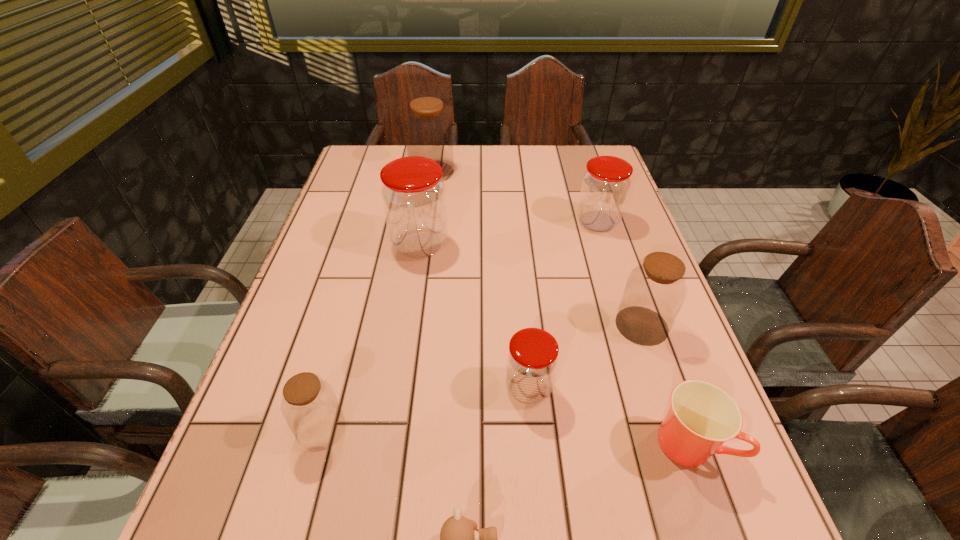
Locate an element on the screen. This screenshot has height=540, width=960. cup that is at the right edge is located at coordinates coord(702,416).

At what (x,y) coordinates should I click in order to perform the action: click on vacant space at the far edge of the desktop. Please return your answer as a coordinate pair (x, y). The width and height of the screenshot is (960, 540). Looking at the image, I should click on (545, 148).

The height and width of the screenshot is (540, 960). Find the location of `vacant space at the near edge of the desktop`. vacant space at the near edge of the desktop is located at coordinates (413, 518).

Where is `free location at the left edge of the desktop`? This screenshot has width=960, height=540. free location at the left edge of the desktop is located at coordinates (361, 303).

This screenshot has height=540, width=960. Identify the location of free location at the right edge. (655, 392).

Locate an element on the screen. blank space at the far left corner is located at coordinates (362, 180).

Identify the location of free region at the far right corner of the desktop. [x=604, y=151].

You are a GUI agent. You are given a task and a screenshot of the screen. Output one action in this format:
    pyautogui.click(x=<x>, y=<y>)
    Task: Click on the blank region between the smallest red jar and the biggest red jar
    Image resolution: width=960 pixels, height=540 pixels.
    Given the screenshot: What is the action you would take?
    pyautogui.click(x=474, y=316)

You are a GUI agent. You are given a task and a screenshot of the screen. Output one action in this format:
    pyautogui.click(x=<x>, y=<y>)
    Task: Click on the unoccupied area between the second nearest brown jar and the smallest red jar
    The height and width of the screenshot is (540, 960).
    Given the screenshot: What is the action you would take?
    585,357

You are a GUI agent. You are given a task and a screenshot of the screen. Output one action in this format:
    pyautogui.click(x=<x>, y=<y>)
    Task: Click on the free space between the rightmost brown jar and the leftmost red jar
    
    Given the screenshot: What is the action you would take?
    pyautogui.click(x=531, y=285)